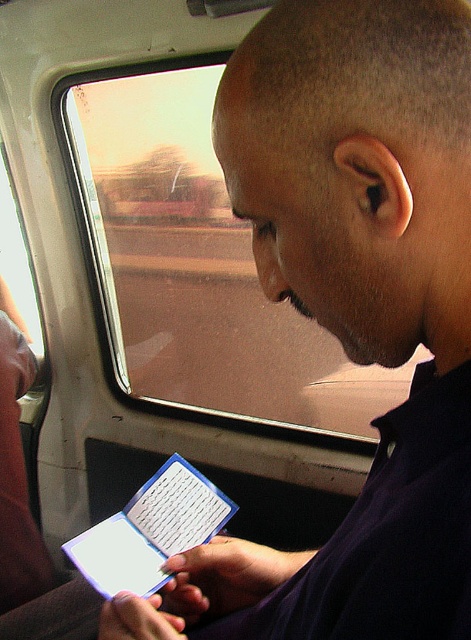
In the scene shown: Can you confirm if transparent glass train window at center is bigger than blue plastic tablet at center?

Yes, transparent glass train window at center is bigger than blue plastic tablet at center.

Can you confirm if transparent glass train window at center is positioned to the left of blue plastic tablet at center?

Indeed, transparent glass train window at center is positioned on the left side of blue plastic tablet at center.

Is point (365, 381) behind point (129, 588)?

Yes, point (365, 381) is behind point (129, 588).

Image resolution: width=471 pixels, height=640 pixels. Find the location of `transparent glass train window at center`. transparent glass train window at center is located at coordinates (194, 262).